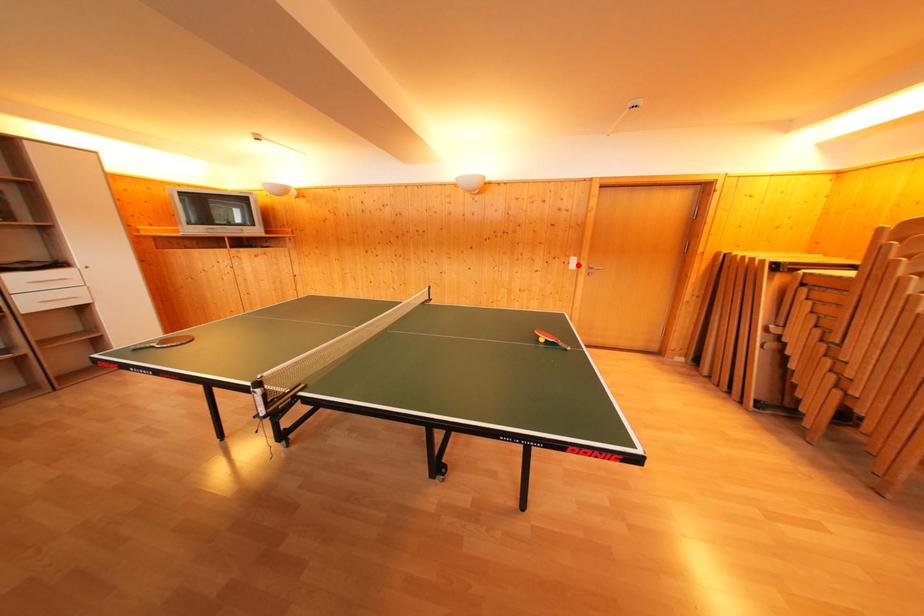
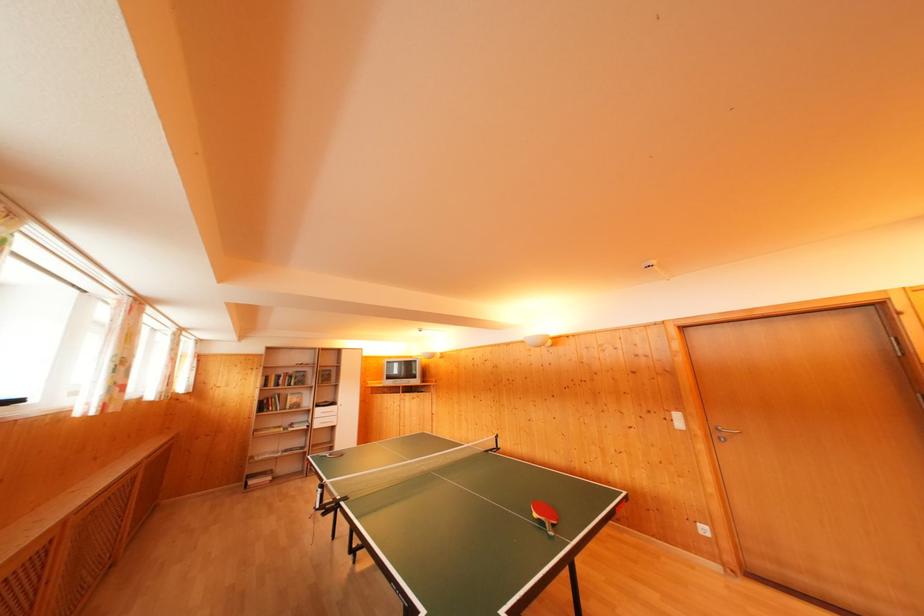
Find the pixel in the second image that matches the highlighted location in the first image.

(682, 421)